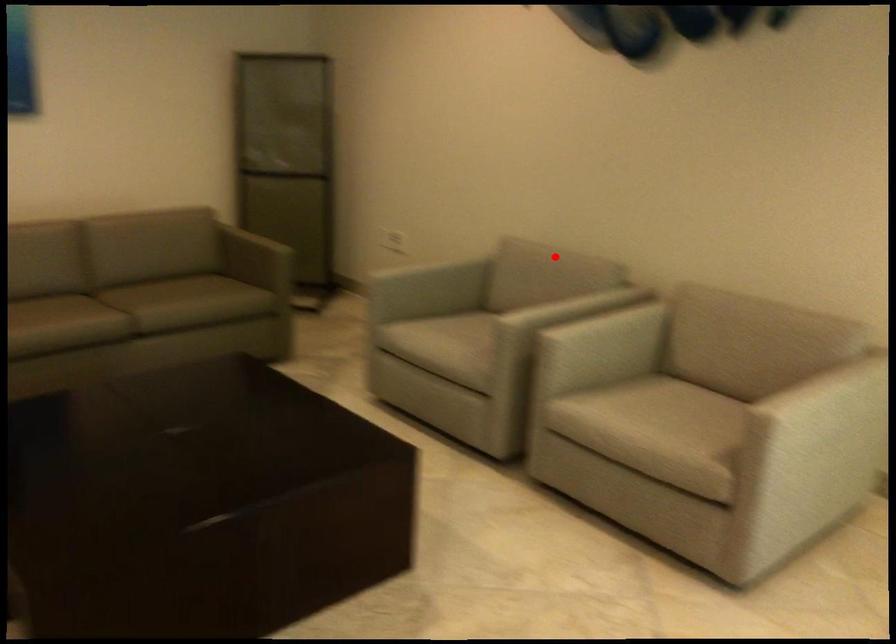
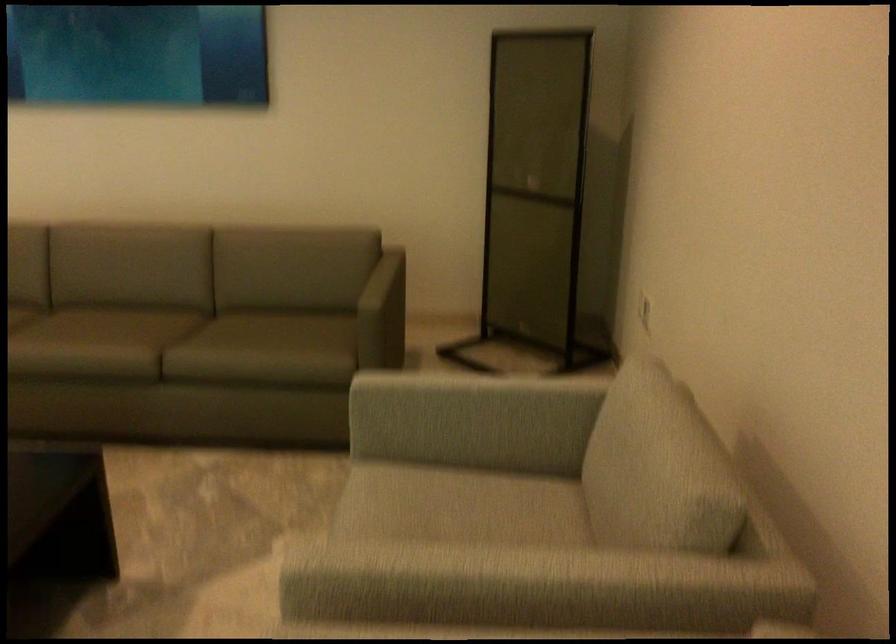
Question: I am providing you with two images of the same scene from different viewpoints. Given a red point in image1, look at the same physical point in image2. Is it:

Choices:
 (A) Closer to the viewpoint
 (B) Farther from the viewpoint

Answer: (A)